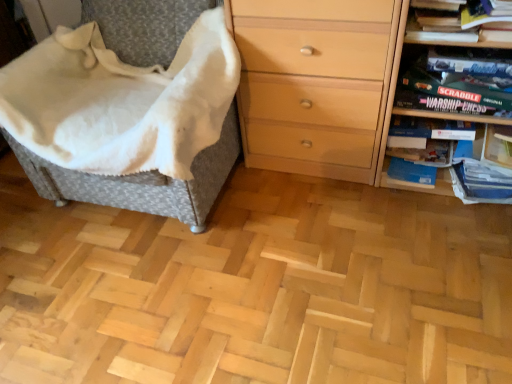
Question: Considering the relative positions of woven fabric chair at left and matte black game box at upper right in the image provided, is woven fabric chair at left to the left or to the right of matte black game box at upper right?

Choices:
 (A) right
 (B) left

Answer: (B)

Question: Considering the positions of woven fabric chair at left and matte black game box at upper right in the image, is woven fabric chair at left bigger or smaller than matte black game box at upper right?

Choices:
 (A) small
 (B) big

Answer: (B)

Question: Which is nearer to the hardcover book at upper right?

Choices:
 (A) light wood chest of drawers at right
 (B) wooden board game at right
 (C) woven fabric chair at left
 (D) matte black game box at upper right

Answer: (D)

Question: Estimate the real-world distances between objects in this image. Which object is closer to the light wood chest of drawers at right?

Choices:
 (A) matte black game box at upper right
 (B) woven fabric chair at left
 (C) hardcover book at upper right
 (D) wooden board game at right

Answer: (D)